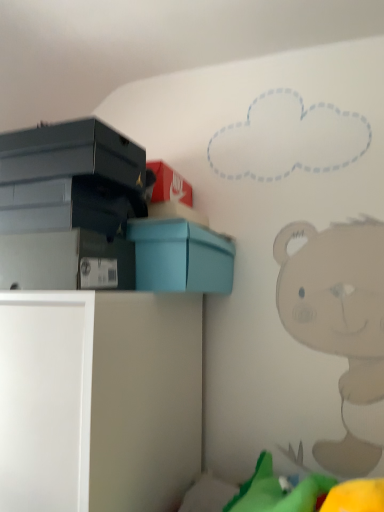
This screenshot has width=384, height=512. What do you see at coordinates (99, 400) in the screenshot?
I see `white matte cabinet at lower left` at bounding box center [99, 400].

Describe the element at coordinates (66, 261) in the screenshot. This screenshot has width=384, height=512. I see `matte gray storage box at lower left` at that location.

Locate an element on the screen. white matte cabinet at lower left is located at coordinates (99, 400).

At what (x,y) coordinates should I click in order to perform the action: click on box behind the white matte cabinet at lower left. Please return your answer as a coordinate pair (x, y). Image resolution: width=384 pixels, height=512 pixels. Looking at the image, I should click on (181, 256).

From a real-world perspective, does white matte cabinet at lower left stand above matte blue box at upper left?

Actually, white matte cabinet at lower left is physically below matte blue box at upper left in the real world.

Is point (182, 423) positioned in front of point (210, 282)?

No, (182, 423) is behind (210, 282).

Considering the sizes of objects white matte cabinet at lower left and matte blue box at upper left in the image provided, who is shorter, white matte cabinet at lower left or matte blue box at upper left?

With less height is matte blue box at upper left.

Can you confirm if matte gray storage box at lower left is wider than matte blue box at upper left?

No.

In the scene shown: From a real-world perspective, which is physically above, matte gray storage box at lower left or matte blue box at upper left?

From a 3D spatial view, matte blue box at upper left is above.

Considering their positions, is matte gray storage box at lower left located in front of or behind matte blue box at upper left?

Clearly, matte gray storage box at lower left is in front of matte blue box at upper left.

Is matte gray storage box at lower left oriented towards white matte cabinet at lower left?

No, matte gray storage box at lower left does not turn towards white matte cabinet at lower left.

Is matte gray storage box at lower left inside the boundaries of white matte cabinet at lower left, or outside?

matte gray storage box at lower left is not enclosed by white matte cabinet at lower left.

Can you confirm if matte gray storage box at lower left is smaller than white matte cabinet at lower left?

Correct, matte gray storage box at lower left occupies less space than white matte cabinet at lower left.

Which is nearer, (147,266) or (43,263)?

Point (147,266).

Is matte blue box at upper left positioned before matte gray storage box at lower left?

No.

Is matte blue box at upper left positioned beyond the bounds of matte gray storage box at lower left?

matte blue box at upper left is positioned outside matte gray storage box at lower left.

Considering the relative sizes of matte blue box at upper left and matte gray storage box at lower left in the image provided, is matte blue box at upper left smaller than matte gray storage box at lower left?

No.

Based on their positions, is white matte cabinet at lower left located to the left or right of matte gray storage box at lower left?

From the image, it's evident that white matte cabinet at lower left is to the left of matte gray storage box at lower left.

Is white matte cabinet at lower left shorter than matte gray storage box at lower left?

Incorrect, the height of white matte cabinet at lower left does not fall short of that of matte gray storage box at lower left.

Considering the relative sizes of white matte cabinet at lower left and matte gray storage box at lower left in the image provided, is white matte cabinet at lower left wider than matte gray storage box at lower left?

Yes.

From a real-world perspective, is white matte cabinet at lower left below matte gray storage box at lower left?

Yes, from a real-world perspective, white matte cabinet at lower left is beneath matte gray storage box at lower left.

Is white matte cabinet at lower left at the back of matte blue box at upper left?

No.

How much distance is there between matte blue box at upper left and white matte cabinet at lower left?

The distance of matte blue box at upper left from white matte cabinet at lower left is 8.72 inches.

Does point (211, 258) appear closer or farther from the camera than point (182, 380)?

Point (211, 258) is positioned closer to the camera compared to point (182, 380).

You are a GUI agent. You are given a task and a screenshot of the screen. Output one action in this format:
    pyautogui.click(x=<x>, y=<y>)
    Task: Click on the furniture lying in front of the matte blue box at upper left
    Image resolution: width=384 pixels, height=512 pixels.
    Given the screenshot: What is the action you would take?
    pyautogui.click(x=99, y=400)

You are a GUI agent. You are given a task and a screenshot of the screen. Output one action in this format:
    pyautogui.click(x=<x>, y=<y>)
    Task: Click on the box above the white matte cabinet at lower left (from a real-world perspective)
    
    Given the screenshot: What is the action you would take?
    coord(181,256)

Where is `box behind the matte gray storage box at lower left`? box behind the matte gray storage box at lower left is located at coordinates (181, 256).

Based on their spatial positions, is white matte cabinet at lower left or matte blue box at upper left further from matte gray storage box at lower left?

white matte cabinet at lower left lies further to matte gray storage box at lower left than the other object.

Estimate the real-world distances between objects in this image. Which object is closer to white matte cabinet at lower left, matte blue box at upper left or matte gray storage box at lower left?

matte gray storage box at lower left is positioned closer to the anchor white matte cabinet at lower left.

When comparing their distances from matte gray storage box at lower left, does matte blue box at upper left or white matte cabinet at lower left seem closer?

Based on the image, matte blue box at upper left appears to be nearer to matte gray storage box at lower left.

Which object lies further to the anchor point matte blue box at upper left, matte gray storage box at lower left or white matte cabinet at lower left?

Based on the image, white matte cabinet at lower left appears to be further to matte blue box at upper left.

Based on their spatial positions, is white matte cabinet at lower left or matte gray storage box at lower left further from matte blue box at upper left?

Based on the image, white matte cabinet at lower left appears to be further to matte blue box at upper left.

Considering their positions, is matte gray storage box at lower left positioned further to white matte cabinet at lower left than matte blue box at upper left?

Based on the image, matte blue box at upper left appears to be further to white matte cabinet at lower left.

The width and height of the screenshot is (384, 512). I want to click on storage box between matte blue box at upper left and white matte cabinet at lower left from top to bottom, so [66, 261].